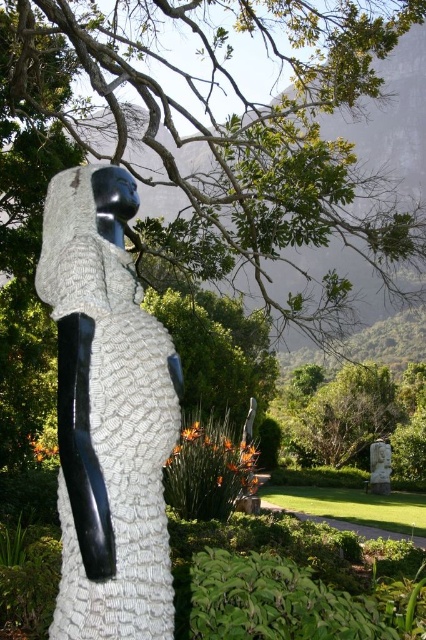
Question: Where is textured white statue at center located in relation to white marble statue at lower right in the image?

Choices:
 (A) below
 (B) above

Answer: (B)

Question: Is green leafy tree at upper center positioned in front of textured white statue at center?

Choices:
 (A) no
 (B) yes

Answer: (A)

Question: Can you confirm if green leafy tree at upper center is positioned to the right of white marble statue at lower right?

Choices:
 (A) yes
 (B) no

Answer: (B)

Question: Which of the following is the closest to the observer?

Choices:
 (A) (199, 100)
 (B) (60, 248)

Answer: (B)

Question: Which object is farther from the camera taking this photo?

Choices:
 (A) green leafy tree at upper center
 (B) textured white statue at center
 (C) white marble statue at lower right

Answer: (C)

Question: Which of these objects is positioned farthest from the green leafy tree at upper center?

Choices:
 (A) textured white statue at center
 (B) white marble statue at lower right

Answer: (B)